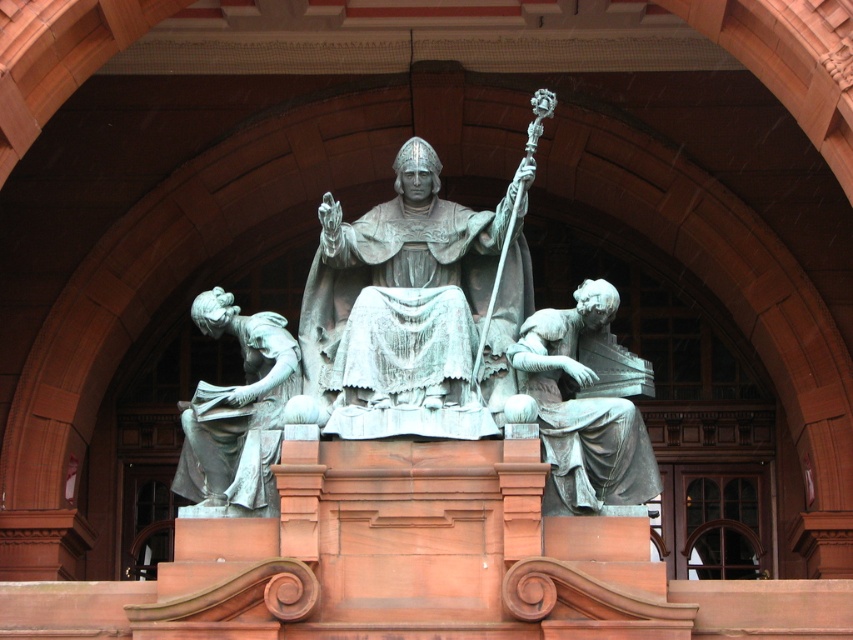
You are a GUI agent. You are given a task and a screenshot of the screen. Output one action in this format:
    pyautogui.click(x=<x>, y=<y>)
    Task: Click on the green patina statue at lower right
    The height and width of the screenshot is (640, 853).
    Given the screenshot: What is the action you would take?
    pyautogui.click(x=585, y=404)

Which is in front, point (567, 317) or point (218, 483)?

Positioned in front is point (218, 483).

Who is more forward, (577, 513) or (213, 464)?

Positioned in front is point (577, 513).

Identify the location of green patina statue at lower right. (585, 404).

Does bronze statue at center have a smaller size compared to green patina statue at left?

Actually, bronze statue at center might be larger than green patina statue at left.

This screenshot has height=640, width=853. Describe the element at coordinates (415, 308) in the screenshot. I see `bronze statue at center` at that location.

Locate an element on the screen. bronze statue at center is located at coordinates (415, 308).

Measure the distance between bronze statue at center and green patina statue at lower right.

bronze statue at center is 13.10 feet from green patina statue at lower right.

Can you confirm if bronze statue at center is positioned to the right of green patina statue at lower right?

Answer: No, bronze statue at center is not to the right of green patina statue at lower right.

The image size is (853, 640). I want to click on bronze statue at center, so click(415, 308).

At what (x,y) coordinates should I click in order to perform the action: click on bronze statue at center. Please return your answer as a coordinate pair (x, y). Looking at the image, I should click on (415, 308).